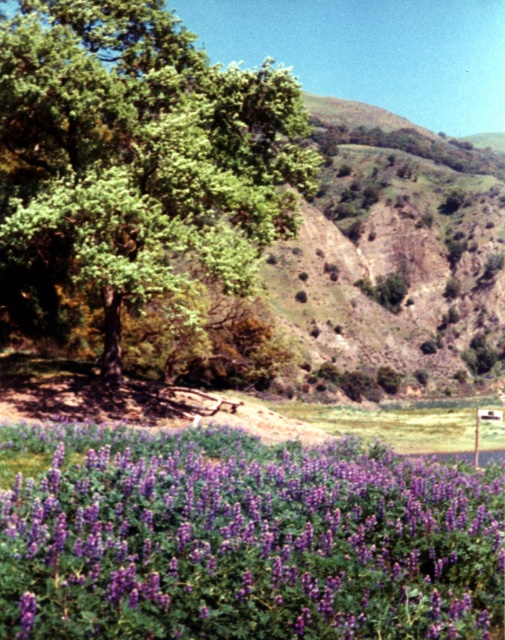
Question: Which point is farther to the camera?

Choices:
 (A) green leafy tree at upper left
 (B) purple soft-textured flowers at lower center

Answer: (A)

Question: Which point is closer to the camera?

Choices:
 (A) (315, 483)
 (B) (477, 424)
 (C) (71, 266)

Answer: (A)

Question: Is purple soft-textured flowers at lower center smaller than white plastic street sign at lower right?

Choices:
 (A) no
 (B) yes

Answer: (B)

Question: Which point is closer to the camera taking this photo?

Choices:
 (A) (26, 480)
 (B) (495, 419)
 (C) (186, 132)

Answer: (A)

Question: Can you confirm if purple soft-textured flowers at lower center is smaller than white plastic street sign at lower right?

Choices:
 (A) no
 (B) yes

Answer: (B)

Question: Is purple soft-textured flowers at lower center above green leafy tree at upper left?

Choices:
 (A) yes
 (B) no

Answer: (B)